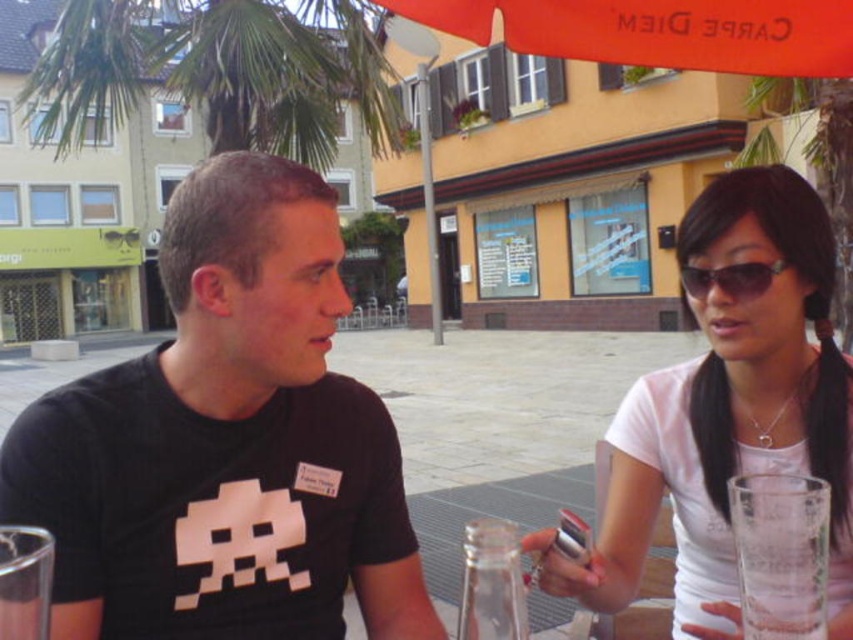
Question: Which point is farther to the camera?

Choices:
 (A) (236, 337)
 (B) (726, 280)
 (C) (825, 595)

Answer: (B)

Question: Does clear glass at lower right come in front of sunglasses at right?

Choices:
 (A) yes
 (B) no

Answer: (A)

Question: Considering the real-world distances, which object is closest to the white matte shirt at right?

Choices:
 (A) green leafy palm tree at upper left
 (B) clear glass at lower right
 (C) black matte t-shirt at center

Answer: (B)

Question: Does green leafy palm tree at upper left appear on the left side of clear glass at lower right?

Choices:
 (A) no
 (B) yes

Answer: (B)

Question: Can you confirm if green leafy palm tree at upper left is positioned to the right of sunglasses at right?

Choices:
 (A) yes
 (B) no

Answer: (B)

Question: Which object is positioned farthest from the green leafy palm tree at upper left?

Choices:
 (A) white matte shirt at right
 (B) sunglasses at right
 (C) black matte t-shirt at center

Answer: (C)